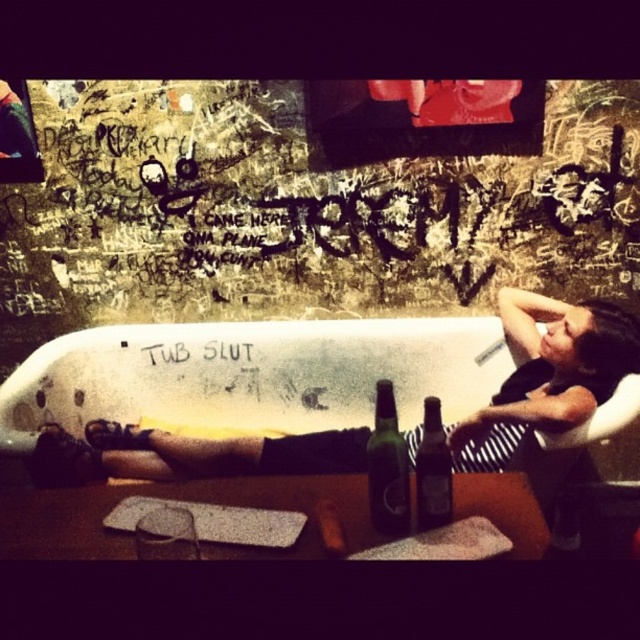
Between black fabric shirt at center and brown glass bottle at center, which one is positioned lower?

Positioned lower is black fabric shirt at center.

The image size is (640, 640). Describe the element at coordinates (547, 376) in the screenshot. I see `black fabric shirt at center` at that location.

Where is `black fabric shirt at center`? black fabric shirt at center is located at coordinates (547, 376).

This screenshot has height=640, width=640. I want to click on black fabric shirt at center, so click(547, 376).

Looking at this image, who is positioned more to the left, green glass bottle at center or brown glass bottle at center?

From the viewer's perspective, green glass bottle at center appears more on the left side.

Who is positioned more to the right, green glass bottle at center or brown glass bottle at center?

brown glass bottle at center

Where is `green glass bottle at center`? This screenshot has height=640, width=640. green glass bottle at center is located at coordinates (387, 467).

In the scene shown: Between black fabric shirt at center and green glass bottle at center, which one has less height?

Standing shorter between the two is green glass bottle at center.

Can you confirm if black fabric shirt at center is thinner than green glass bottle at center?

In fact, black fabric shirt at center might be wider than green glass bottle at center.

Does point (124, 452) come in front of point (401, 436)?

No, it is behind (401, 436).

This screenshot has width=640, height=640. Identify the location of black fabric shirt at center. (547, 376).